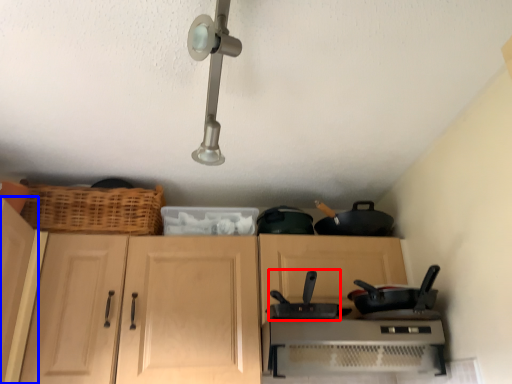
Question: Which object appears closest to the camera in this image, wok (highlighted by a red box) or cabinetry (highlighted by a blue box)?

Choices:
 (A) wok
 (B) cabinetry

Answer: (B)